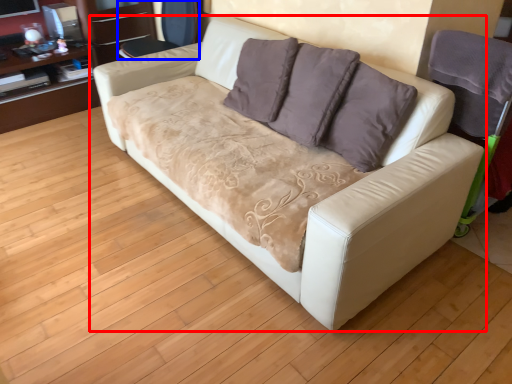
Question: Which of the following is the closest to the observer, studio couch (highlighted by a red box) or armchair (highlighted by a blue box)?

Choices:
 (A) studio couch
 (B) armchair

Answer: (A)